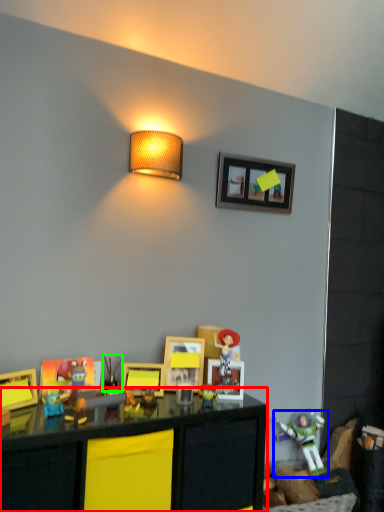
Question: Based on their relative distances, which object is nearer to table (highlighted by a red box)? Choose from toy (highlighted by a blue box) and toy (highlighted by a green box).

Choices:
 (A) toy
 (B) toy

Answer: (B)